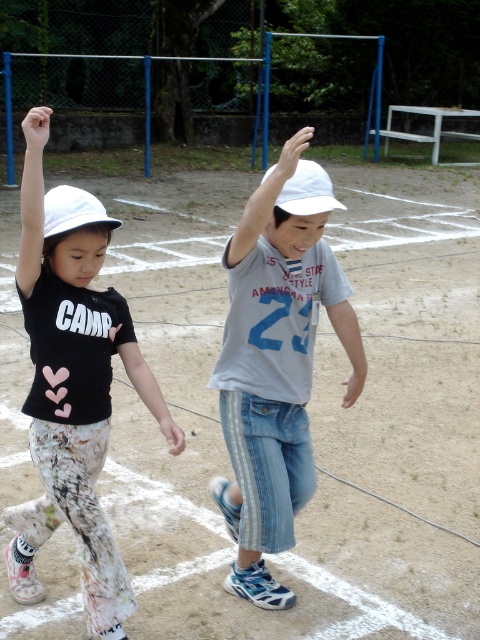
Is point (157, 420) closer to camera compared to point (354, 397)?

Yes, point (157, 420) is closer to viewer.

Can you confirm if pink fabric hand at center is bigger than pink matte hand at center?

Correct, pink fabric hand at center is larger in size than pink matte hand at center.

This screenshot has width=480, height=640. I want to click on pink fabric hand at center, so click(x=171, y=433).

Between point (38, 186) and point (300, 186), which one is positioned behind?

The point (300, 186) is more distant.

Who is shorter, white matte pants at left or white matte baseball hat at upper center?

white matte baseball hat at upper center

Is point (36, 460) behind point (300, 182)?

Yes.

Find the location of `white matte pants at left`. white matte pants at left is located at coordinates (72, 403).

Between white matte hand at upper center and pink matte hand at center, which one is positioned higher?

white matte hand at upper center

This screenshot has height=640, width=480. Find the location of `white matte hand at upper center`. white matte hand at upper center is located at coordinates (291, 154).

The image size is (480, 640). I want to click on white matte hand at upper center, so click(291, 154).